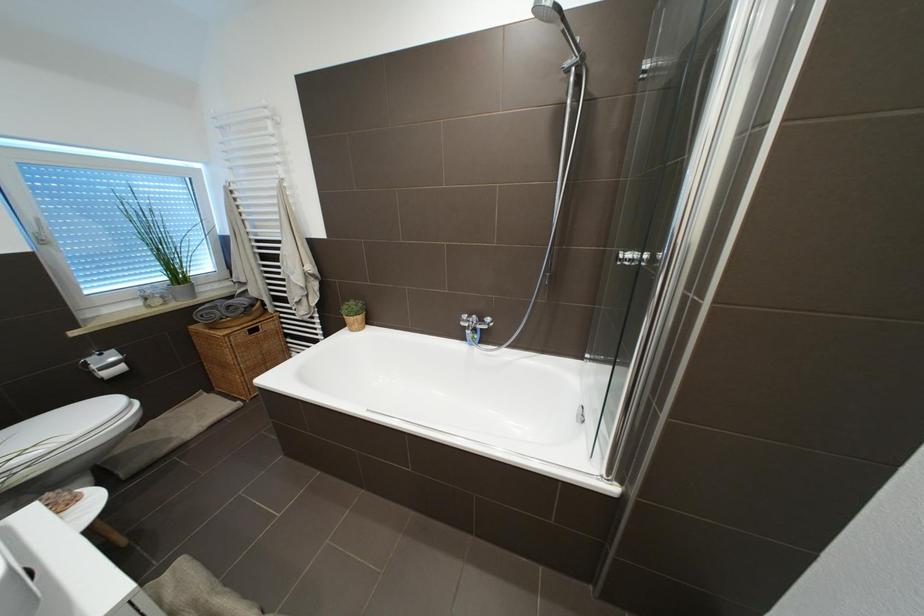
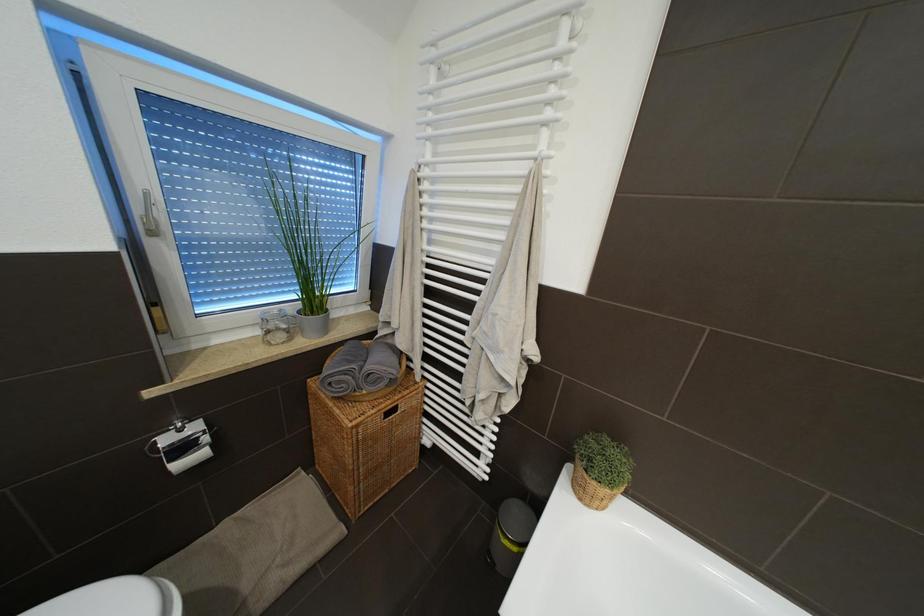
What movement of the cameraman would produce the second image?

The cameraman moved toward left, forward.